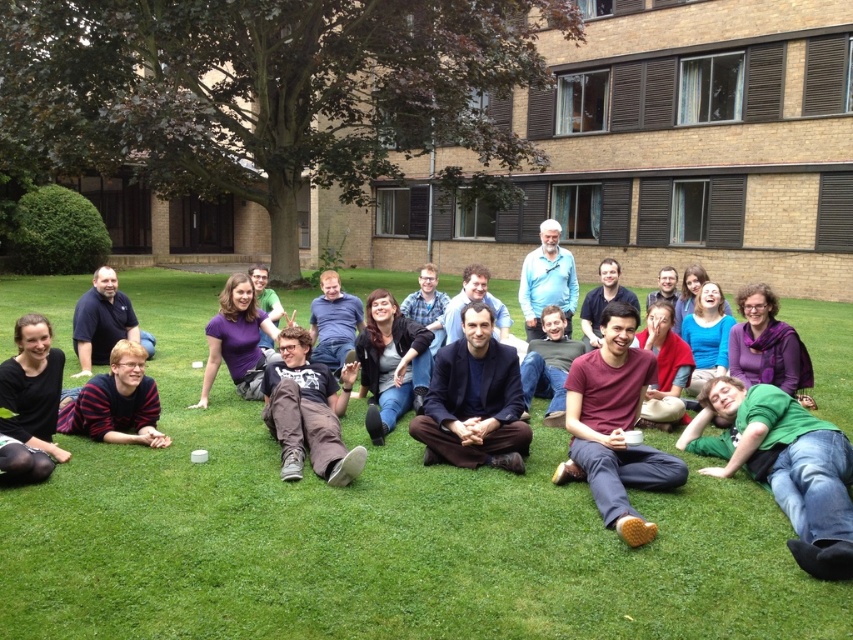
What color is the object located at the coordinates point (474,401) in the image?

The object at point (474,401) is dark blue fabric at center.

Based on the photo, you are a photographer trying to capture a group photo of the scene. You want to ensure both the dark blue fabric at center and the striped sweater at lower left are visible in the frame. Based on their positions, which object is located to the right side of the other?

The dark blue fabric at center is positioned to the right of the striped sweater at lower left.

You are organizing a photo shoot and need to ensure that all participants are visible in the frame. The maroon cotton shirt at center and the striped sweater at lower left are two key elements to focus on. Considering their sizes, which one might require more attention to ensure it stands out in the composition?

The maroon cotton shirt at center is bigger than the striped sweater at lower left, so it might naturally stand out more in the composition. However, the striped sweater at lower left, being smaller, might need additional focus or positioning to ensure it is clearly visible in the photo shoot.